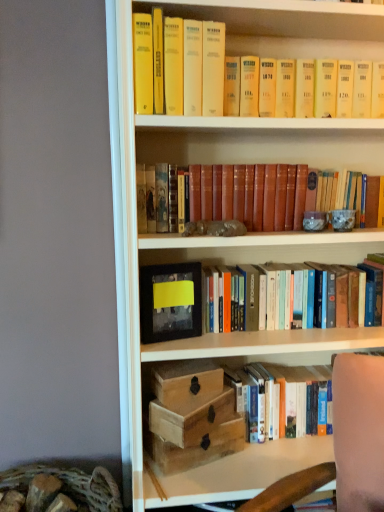
I want to click on free space above wooden box at lower center, the 2th box when ordered from bottom to top (from a real-world perspective), so click(194, 399).